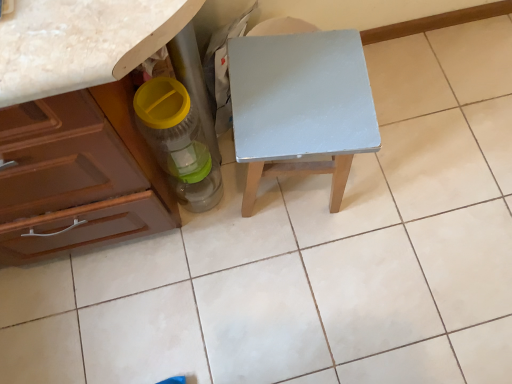
Question: Choose the correct answer: Is translucent plastic bottle at lower left inside light gray wood table at center or outside it?

Choices:
 (A) outside
 (B) inside

Answer: (A)

Question: Based on their sizes in the image, would you say translucent plastic bottle at lower left is bigger or smaller than light gray wood table at center?

Choices:
 (A) small
 (B) big

Answer: (A)

Question: Considering the relative positions of translucent plastic bottle at lower left and light gray wood table at center in the image provided, is translucent plastic bottle at lower left to the left or to the right of light gray wood table at center?

Choices:
 (A) left
 (B) right

Answer: (A)

Question: From their relative heights in the image, would you say light gray wood table at center is taller or shorter than translucent plastic bottle at lower left?

Choices:
 (A) short
 (B) tall

Answer: (B)

Question: Based on their sizes in the image, would you say light gray wood table at center is bigger or smaller than translucent plastic bottle at lower left?

Choices:
 (A) big
 (B) small

Answer: (A)

Question: Is light gray wood table at center in front of or behind translucent plastic bottle at lower left in the image?

Choices:
 (A) behind
 (B) front

Answer: (A)

Question: Is point (347, 52) positioned closer to the camera than point (206, 185)?

Choices:
 (A) farther
 (B) closer

Answer: (B)